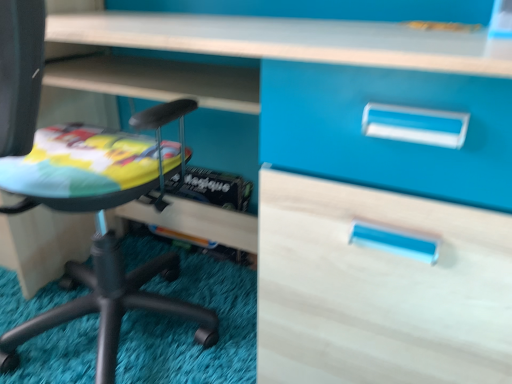
I want to click on matte black chair at lower left, so click(x=84, y=191).

Describe the element at coordinates (84, 191) in the screenshot. The height and width of the screenshot is (384, 512). I see `matte black chair at lower left` at that location.

Measure the distance between point [87,173] and camera.

A distance of 30.47 inches exists between point [87,173] and camera.

Locate an element on the screen. matte black chair at lower left is located at coordinates (84, 191).